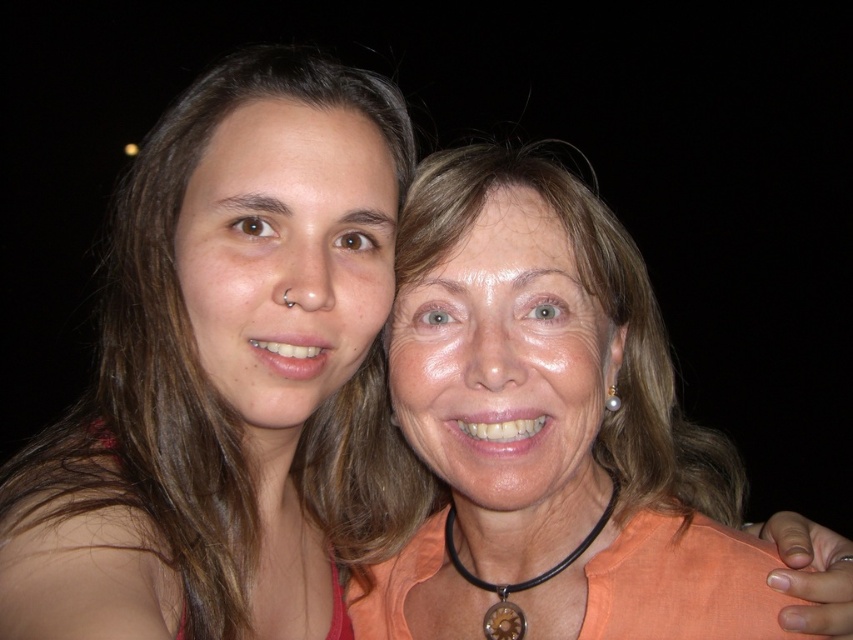
You are a photographer adjusting the lighting for a portrait. You notice the matte orange blouse at center and the black leather necklace at center in the frame. Which object should you adjust the light towards if you want to highlight the one that is positioned to the left?

The black leather necklace at center is positioned to the left of the matte orange blouse at center, so you should adjust the light towards the black leather necklace at center to highlight it.

You are a photographer who wants to adjust the lighting so that the matte orange blouse at center and the black leather necklace at center are equally highlighted. Based on their current positions, which object should you move closer to the light source?

The black leather necklace at center is shorter than the matte orange blouse at center, so moving it closer to the light source will help balance their highlights.

You are positioning a spotlight for a photography setup. The spotlight needs to be placed to the right of the matte orange blouse at center to highlight the model on the right. Considering the coordinates provided in the description, where should the spotlight be positioned relative to the blouse?

The matte orange blouse at center is located at point (599, 401). To position the spotlight to the right of it, you should place the spotlight at a coordinate with an x value greater than 0.628 and the same y value of 0.703.